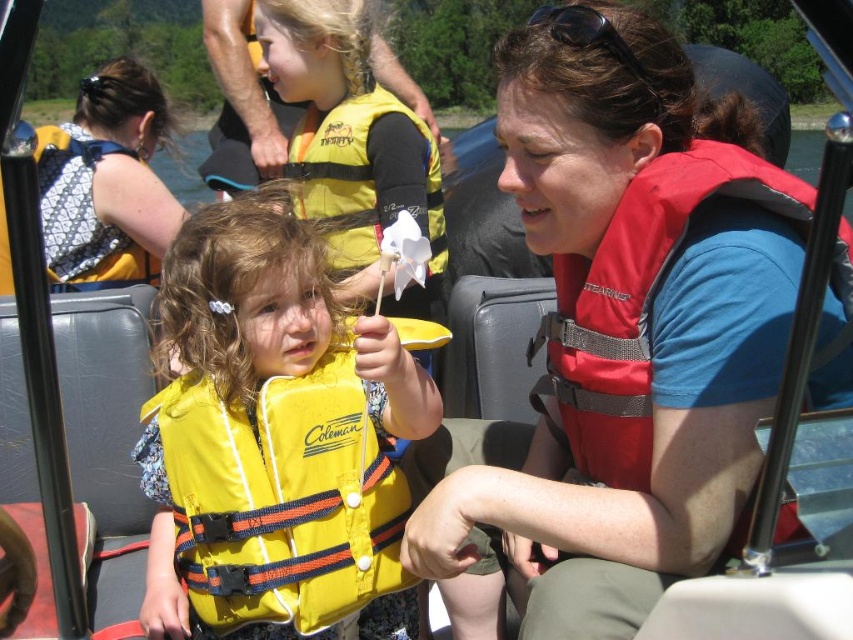
Who is taller, red fabric life vest at right or yellow life vest at center?

With more height is red fabric life vest at right.

Can you confirm if red fabric life vest at right is smaller than yellow life vest at center?

No, red fabric life vest at right is not smaller than yellow life vest at center.

Who is more forward, (627, 417) or (321, 182)?

Point (627, 417)

This screenshot has height=640, width=853. In order to click on red fabric life vest at right in this screenshot , I will do `click(637, 301)`.

Is yellow fabric life vest at center positioned behind matte black backpack at upper left?

No, it is in front of matte black backpack at upper left.

The image size is (853, 640). Describe the element at coordinates (277, 497) in the screenshot. I see `yellow fabric life vest at center` at that location.

Image resolution: width=853 pixels, height=640 pixels. What do you see at coordinates (277, 497) in the screenshot? I see `yellow fabric life vest at center` at bounding box center [277, 497].

The height and width of the screenshot is (640, 853). I want to click on yellow fabric life vest at center, so click(277, 497).

Is yellow fabric life vest at center shorter than red fabric life vest at right?

Yes, yellow fabric life vest at center is shorter than red fabric life vest at right.

Consider the image. Which is above, yellow fabric life vest at center or red fabric life vest at right?

Positioned higher is red fabric life vest at right.

I want to click on yellow fabric life vest at center, so [277, 497].

This screenshot has width=853, height=640. I want to click on yellow fabric life vest at center, so (x=277, y=497).